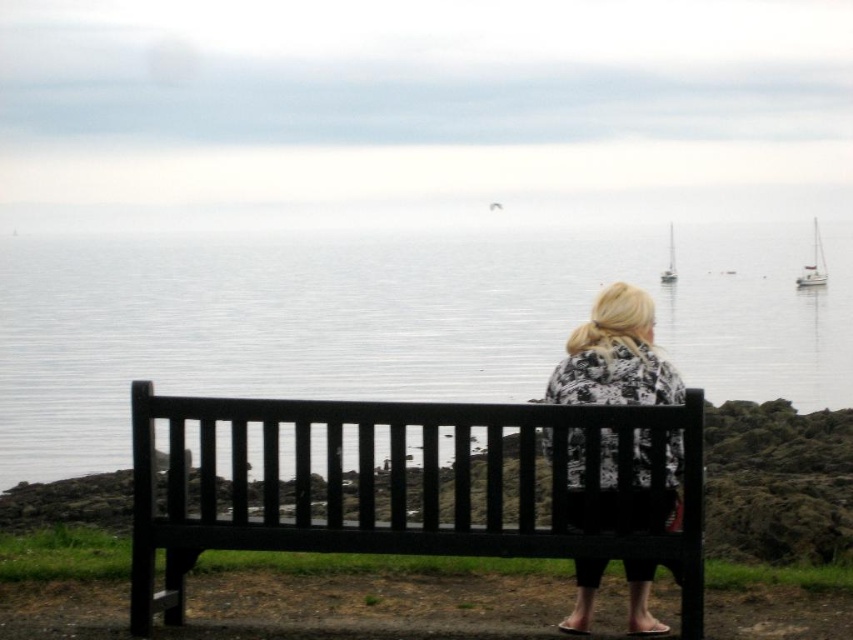
You are standing in the coastal scene and want to place a small flag at the closest point between point (422, 502) and point (822, 260). Which point should you choose?

Point (422, 502) is closer to the viewer than point (822, 260), so you should place the flag at point (422, 502) to be closer.

You are a photographer trying to capture both the black wood bench at center and the white glossy sailboat at upper center in a single frame. Based on their sizes in the image, which object would appear larger in your photo?

The white glossy sailboat at upper center would appear larger in the photo since it is bigger than the black wood bench at center according to the description.

You are standing at the edge of the grassy area near the black wood bench at center and want to walk to the white glossy sailboat at right. Which direction should you move towards?

The black wood bench at center is to the left of the white glossy sailboat at right, so you should move towards the right to reach the white glossy sailboat at right.